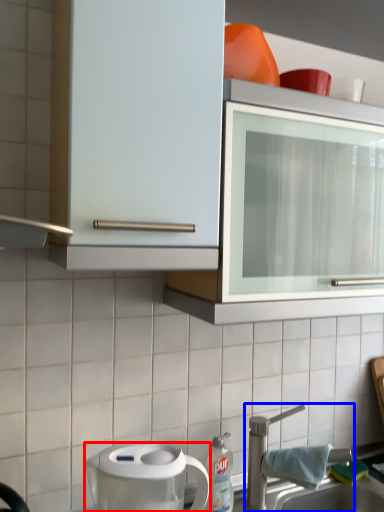
Question: Among these objects, which one is nearest to the camera, home appliance (highlighted by a red box) or tap (highlighted by a blue box)?

Choices:
 (A) home appliance
 (B) tap

Answer: (A)